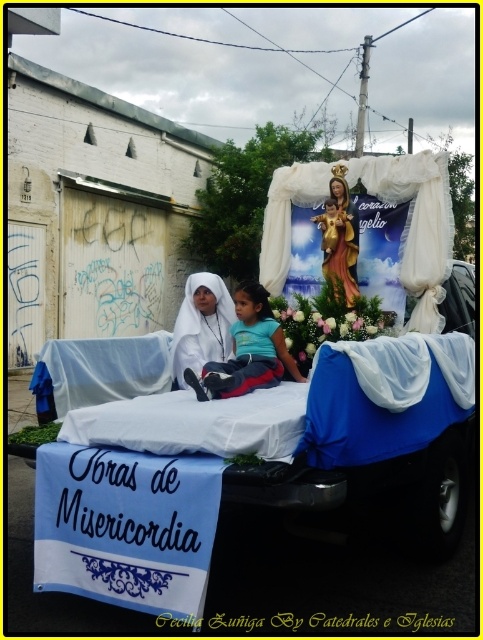
Question: Is white floral bouquet at center to the left of white glossy statue at center from the viewer's perspective?

Choices:
 (A) yes
 (B) no

Answer: (A)

Question: Can you confirm if white cloth at center is positioned to the right of white floral bouquet at center?

Choices:
 (A) yes
 (B) no

Answer: (B)

Question: Can you confirm if blue cotton shirt at center is thinner than white cloth at center?

Choices:
 (A) yes
 (B) no

Answer: (B)

Question: Which of these objects is positioned farthest from the blue cotton shirt at center?

Choices:
 (A) white glossy statue at center
 (B) white cloth at center

Answer: (A)

Question: Which object is farther from the camera taking this photo?

Choices:
 (A) white cloth at center
 (B) blue cotton shirt at center
 (C) white glossy statue at center
 (D) white floral bouquet at center

Answer: (C)

Question: Estimate the real-world distances between objects in this image. Which object is closer to the white glossy statue at center?

Choices:
 (A) blue cotton shirt at center
 (B) white floral bouquet at center
 (C) white cloth at center

Answer: (B)